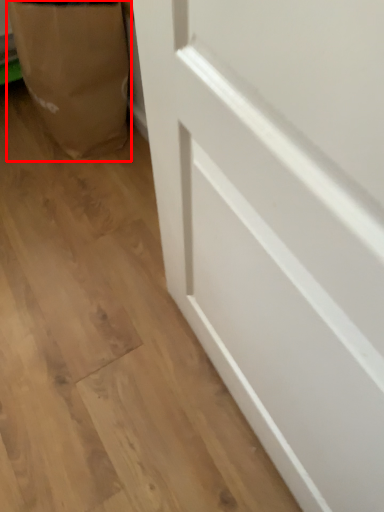
Question: From the image's perspective, considering the relative positions of paper bag (annotated by the red box) and door in the image provided, where is paper bag (annotated by the red box) located with respect to the staircase?

Choices:
 (A) below
 (B) above

Answer: (B)